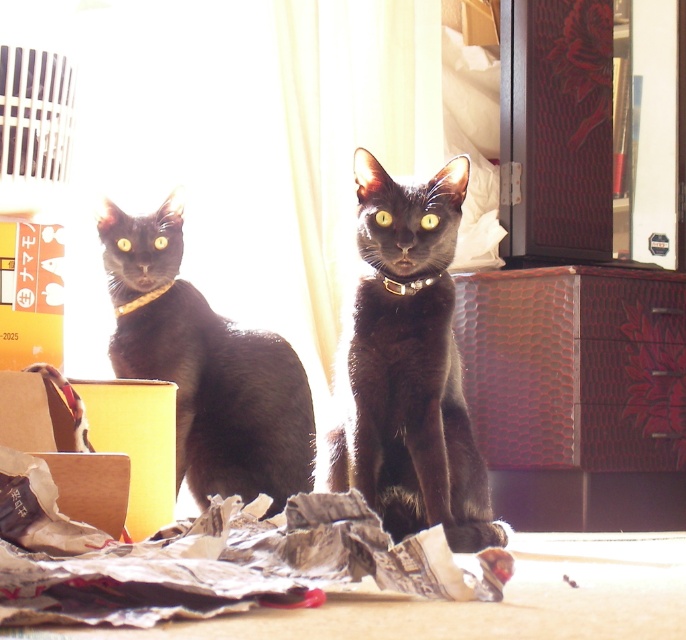
You are a cat owner trying to place a new toy inside the cardboard box at lower left. The toy requires a minimum width of 20 cm to fit. Given that the metallic gold neckband at left is 10 cm wide, can the toy fit in the box?

The cardboard box at lower left is wider than the metallic gold neckband at left, which is 10 cm. Since the box is wider, it likely has a width greater than 10 cm. However, without knowing the exact width of the box, we cannot confirm if it meets the 20 cm requirement. Please measure the box to ensure it is at least 20 cm wide.

You are standing in front of the two cats and want to place a treat between the two points, point (132,296) and point (51,284). Which point is closer to you so you can place the treat correctly?

Point (51,284) is closer to you because it is less further to the viewer than point (132,296).

You are standing in front of the image of two black cats. You need to determine which point, point (32, 371) or point (158, 291), is closer to you. Based on the spatial relationship between these points, which one is nearer?

Point (32, 371) is closer to the viewer than point (158, 291).